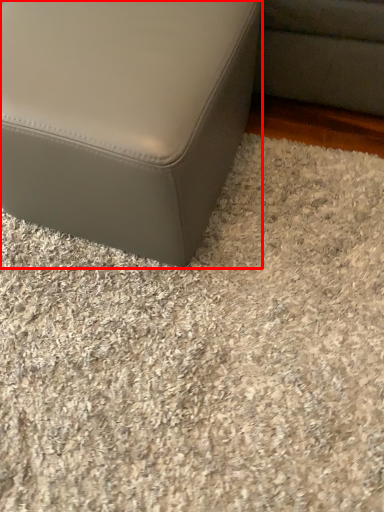
Question: Where is furniture (annotated by the red box) located in relation to gravel in the image?

Choices:
 (A) left
 (B) right

Answer: (A)